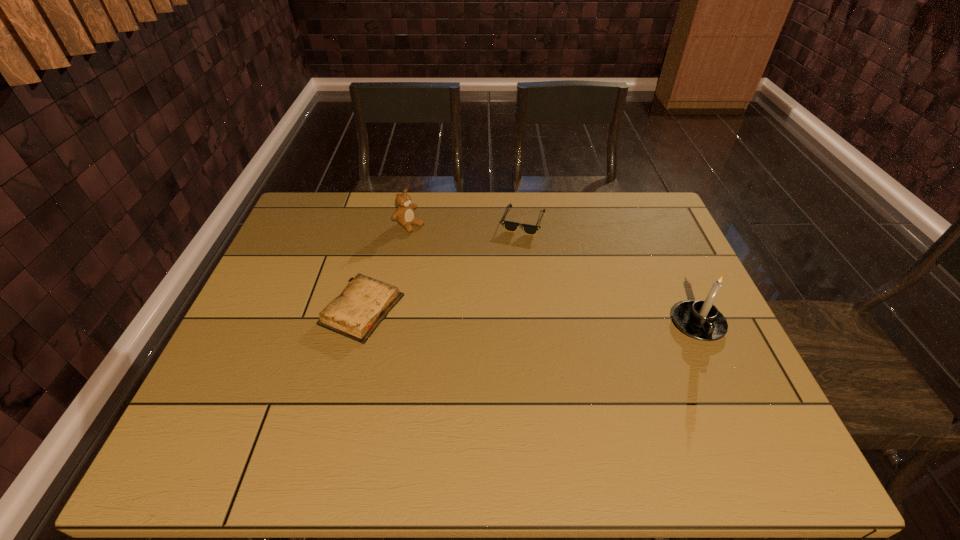
What are the coordinates of `free space between the second tallest object and the third object from left to right` in the screenshot? It's located at (467, 223).

At what (x,y) coordinates should I click in order to perform the action: click on free point between the diary and the sunglasses. Please return your answer as a coordinate pair (x, y). Image resolution: width=960 pixels, height=540 pixels. Looking at the image, I should click on point(443,266).

Identify the location of vacant space in between the teddy bear and the sunglasses. This screenshot has height=540, width=960. (467, 223).

Identify the location of empty location between the teddy bear and the tallest object. The height and width of the screenshot is (540, 960). tap(554, 274).

You are a GUI agent. You are given a task and a screenshot of the screen. Output one action in this format:
    pyautogui.click(x=<x>, y=<y>)
    Task: Click on the free space that is in between the rightmost object and the third object from left to right
    This screenshot has width=960, height=540.
    Given the screenshot: What is the action you would take?
    pyautogui.click(x=611, y=273)

Identify the location of vacant region between the rightmost object and the diary. (530, 317).

Identify the location of blank region between the diary and the second object from right to left. (443, 266).

The image size is (960, 540). In order to click on free point between the diary and the teddy bear in this screenshot , I will do `click(386, 267)`.

At what (x,y) coordinates should I click in order to perform the action: click on unoccupied area between the teddy bear and the sunglasses. Please return your answer as a coordinate pair (x, y). The width and height of the screenshot is (960, 540). Looking at the image, I should click on pyautogui.click(x=467, y=223).

Locate an element on the screen. The image size is (960, 540). vacant region between the tallest object and the teddy bear is located at coordinates (554, 274).